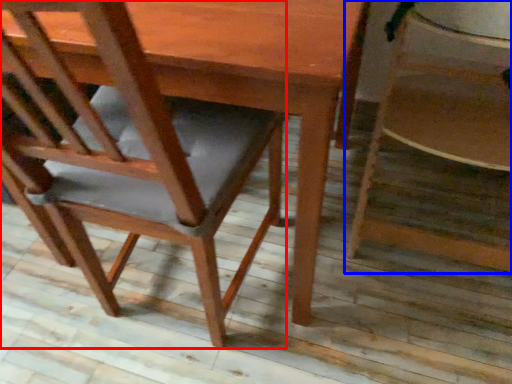
Question: Which object is closer to the camera taking this photo, chair (highlighted by a red box) or chair (highlighted by a blue box)?

Choices:
 (A) chair
 (B) chair

Answer: (A)